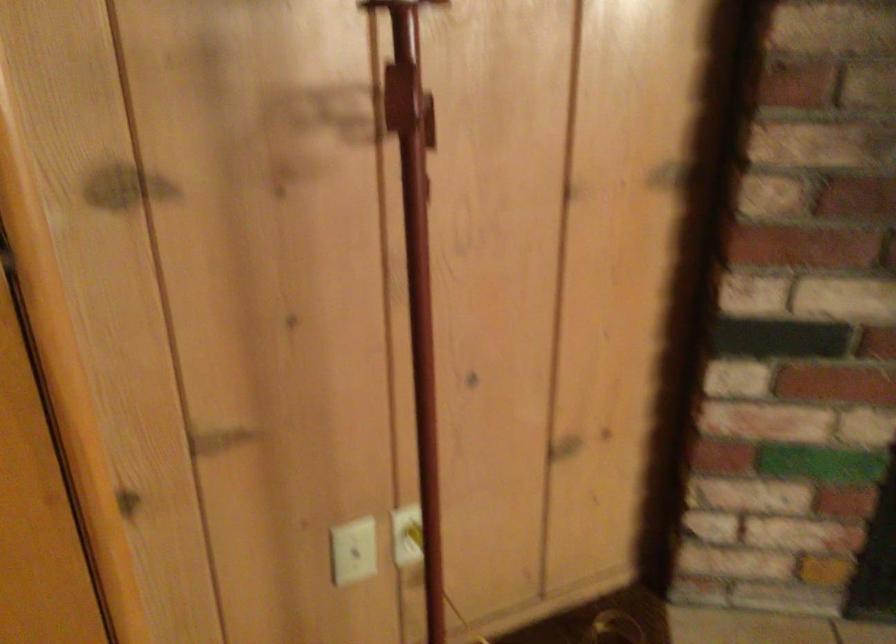
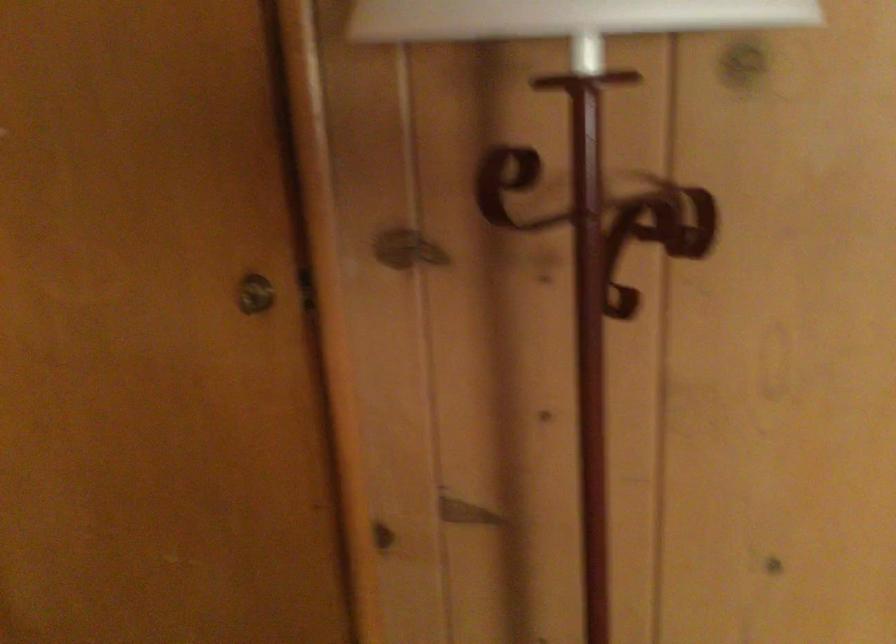
Question: How did the camera likely rotate?

Choices:
 (A) Left
 (B) Right
 (C) Up
 (D) Down

Answer: (A)